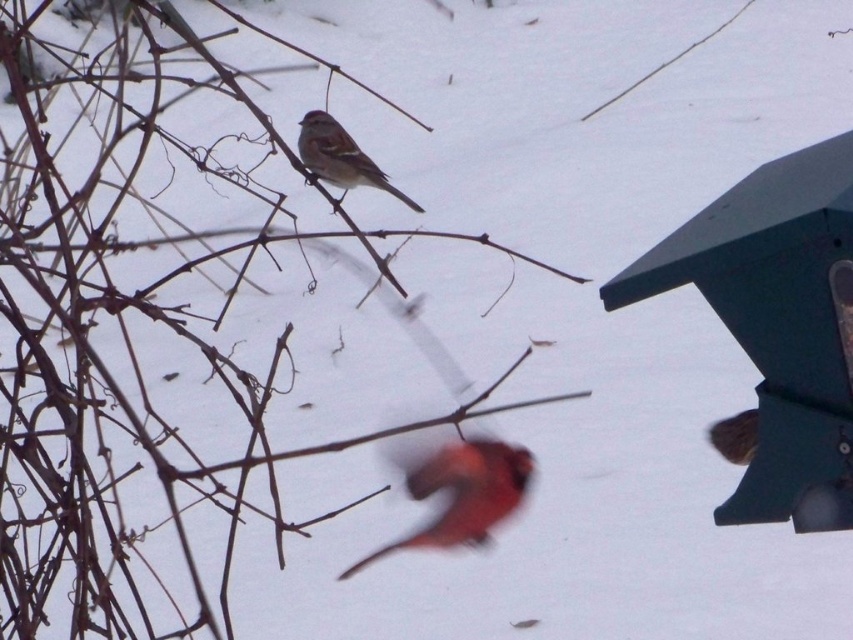
Based on the photo, does blurred orange bird at center have a greater width compared to brown matte sparrow at center?

Correct, the width of blurred orange bird at center exceeds that of brown matte sparrow at center.

Who is taller, blurred orange bird at center or brown matte sparrow at center?

With more height is blurred orange bird at center.

What do you see at coordinates (463, 493) in the screenshot? I see `blurred orange bird at center` at bounding box center [463, 493].

The height and width of the screenshot is (640, 853). I want to click on blurred orange bird at center, so click(463, 493).